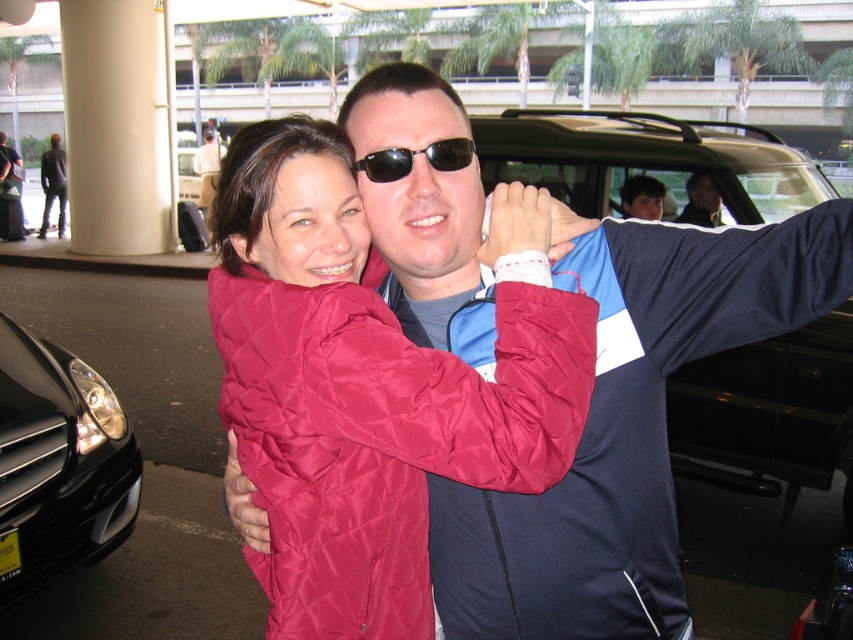
Between quilted red jacket at center and black plastic sunglasses at center, which one appears on the left side from the viewer's perspective?

quilted red jacket at center is more to the left.

Between quilted red jacket at center and black plastic sunglasses at center, which one appears on the right side from the viewer's perspective?

From the viewer's perspective, black plastic sunglasses at center appears more on the right side.

Is point (427, 448) less distant than point (390, 161)?

Yes, it is.

Where is `quilted red jacket at center`? quilted red jacket at center is located at coordinates (364, 388).

Who is positioned more to the right, black glossy car at lower left or black plastic sunglasses at center?

From the viewer's perspective, black plastic sunglasses at center appears more on the right side.

Can you confirm if black glossy car at lower left is smaller than black plastic sunglasses at center?

Incorrect, black glossy car at lower left is not smaller in size than black plastic sunglasses at center.

Is point (15, 358) behind point (434, 145)?

Yes.

Identify the location of black glossy car at lower left. coord(57,464).

Can you confirm if quilted red jacket at center is wider than black glossy car at lower left?

In fact, quilted red jacket at center might be narrower than black glossy car at lower left.

Does quilted red jacket at center have a lesser height compared to black glossy car at lower left?

Yes.

Find the location of a particular element. The height and width of the screenshot is (640, 853). quilted red jacket at center is located at coordinates pyautogui.click(x=364, y=388).